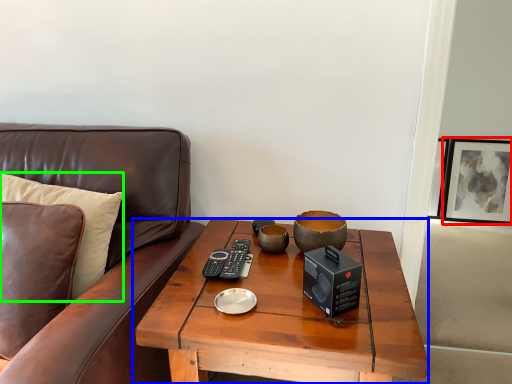
Question: Which object is positioned farthest from picture frame (highlighted by a red box)? Select from coffee table (highlighted by a blue box) and pillow (highlighted by a green box).

Choices:
 (A) coffee table
 (B) pillow

Answer: (B)